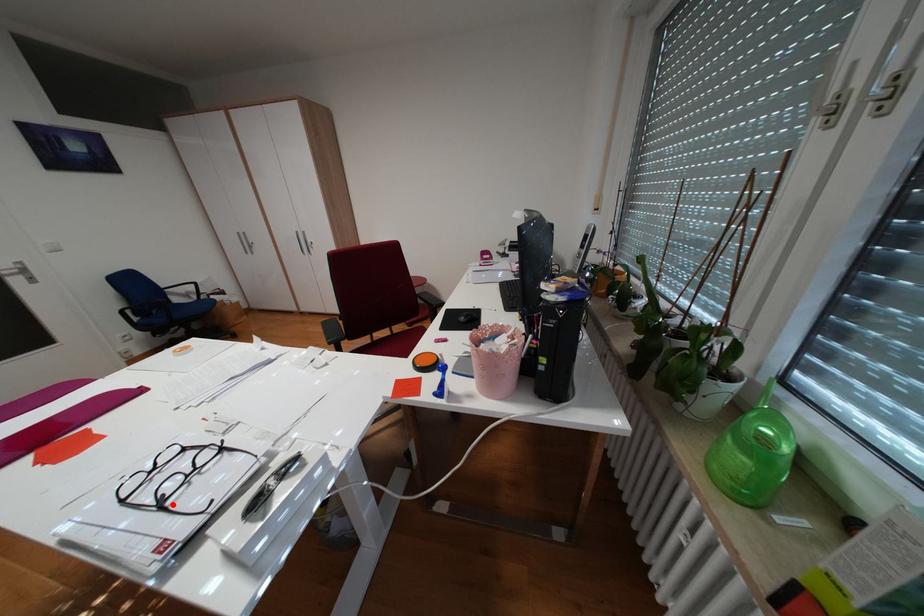
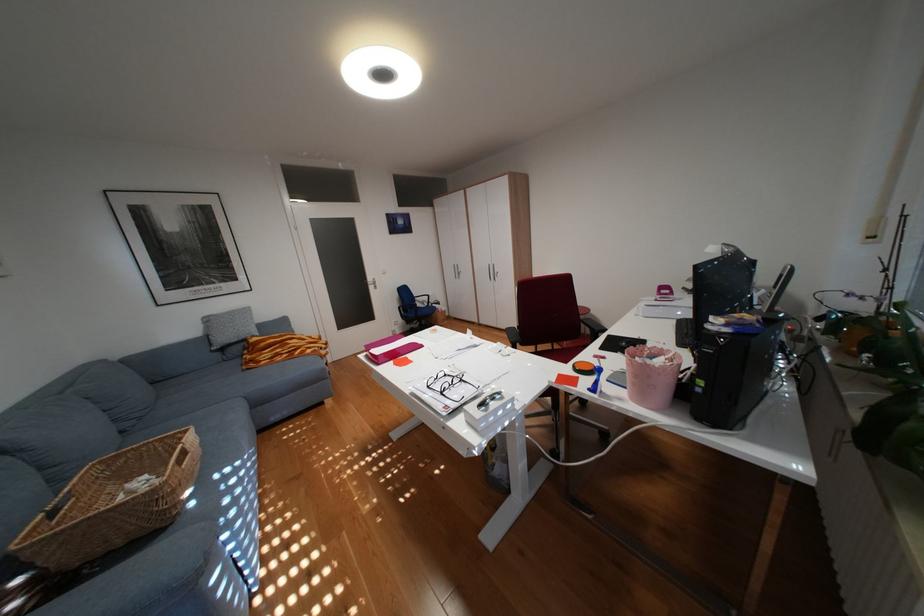
Locate, in the second image, the point that corresponds to the highlighted location in the first image.

(454, 392)